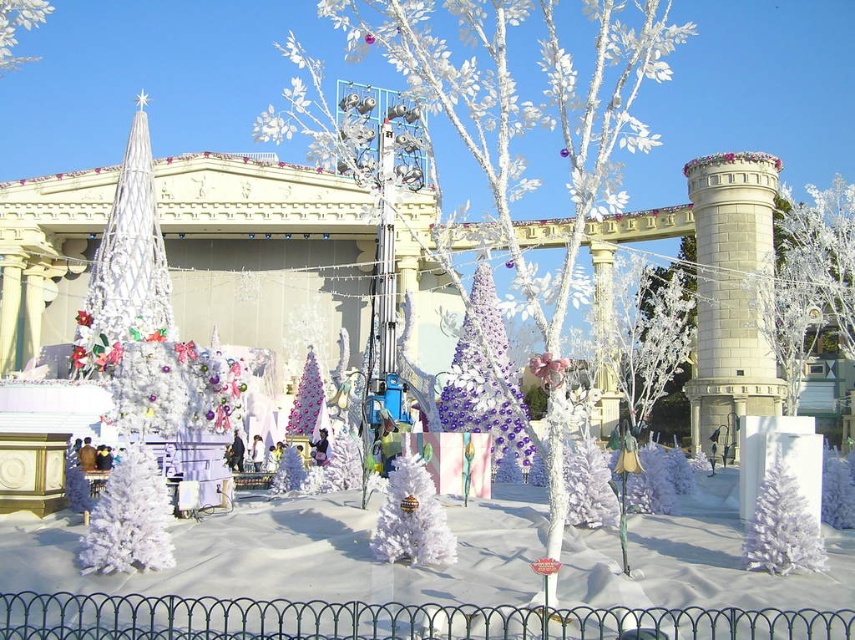
You are standing on the stage and want to place a new decoration between the white stone tower at center right and the shiny purple tinsel tree at center. Which object should you move closer to you to create space?

You should move the white stone tower at center right closer to you because it is closer to you than the shiny purple tinsel tree at center, so moving it would create space between them.

You are an event planner standing at the back of the stage. You need to move the white matte christmas tree at center and the white matte tree at upper left to make space for a new display. Which tree should you move first to ensure the other remains visible to the audience?

You should move the white matte christmas tree at center first because it is in front of the white matte tree at upper left. Removing it first will allow the white matte tree at upper left to become visible to the audience once the obstructing tree is moved.